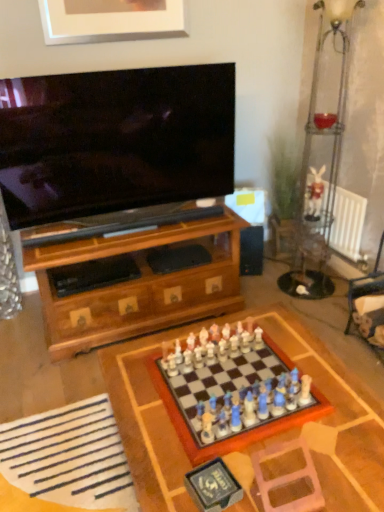
Question: From their relative heights in the image, would you say wooden chess set at center is taller or shorter than wooden chessboard at center?

Choices:
 (A) short
 (B) tall

Answer: (A)

Question: From the image's perspective, is wooden chess set at center located above or below wooden chessboard at center?

Choices:
 (A) below
 (B) above

Answer: (B)

Question: Estimate the real-world distances between objects in this image. Which object is farther from the wooden chessboard at center?

Choices:
 (A) wooden chess set at center
 (B) pink plastic swivel chair at lower right, the first swivel chair positioned from the left
 (C) brushed silver picture frame at upper center
 (D) white fabric at lower left
 (E) white fabric swivel chair at lower right, which is the 2th swivel chair from bottom to top

Answer: (C)

Question: Considering the real-world distances, which object is farthest from the white fabric swivel chair at lower right, which appears as the second swivel chair when viewed from the left?

Choices:
 (A) pink plastic swivel chair at lower right, which ranks as the first swivel chair in bottom-to-top order
 (B) white fabric rabbit at right
 (C) white fabric at lower left
 (D) brushed silver picture frame at upper center
 (E) wooden chess set at center

Answer: (D)